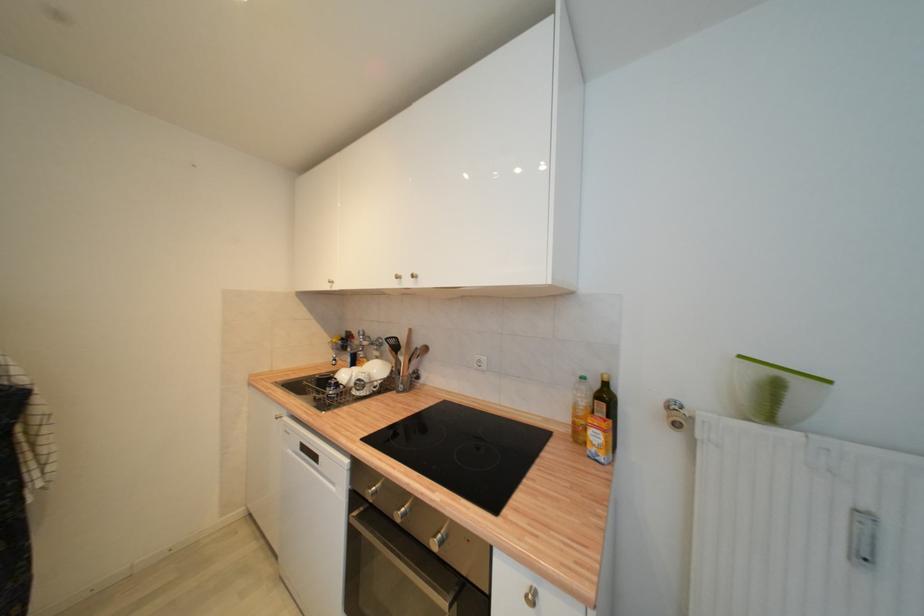
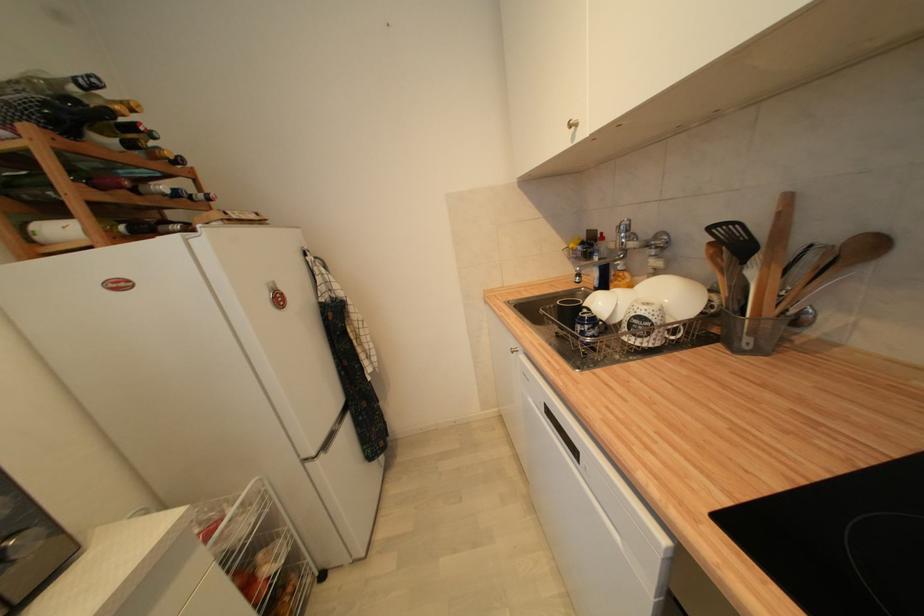
The point at (321, 460) is marked in the first image. Where is the corresponding point in the second image?

(578, 453)